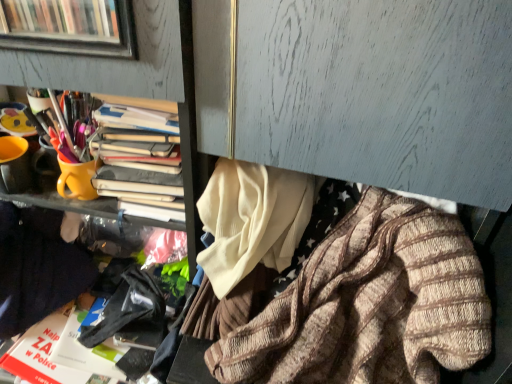
Question: In the image, is yellow matte cup at upper left on the left side or the right side of dark blue sweater at left, which ranks as the first clothing in left-to-right order?

Choices:
 (A) left
 (B) right

Answer: (B)

Question: From a real-world perspective, is yellow matte cup at upper left positioned above or below dark blue sweater at left, which ranks as the first clothing in left-to-right order?

Choices:
 (A) below
 (B) above

Answer: (B)

Question: Considering the real-world distances, which object is closest to the dark blue sweater at left, which ranks as the first clothing in left-to-right order?

Choices:
 (A) yellow matte cup at upper left
 (B) knitted wool sweater at lower right, placed as the first clothing when sorted from right to left

Answer: (A)

Question: Which object is the closest to the yellow matte cup at upper left?

Choices:
 (A) dark blue sweater at left, acting as the second clothing starting from the right
 (B) knitted wool sweater at lower right, which is counted as the 2th clothing, starting from the left

Answer: (A)